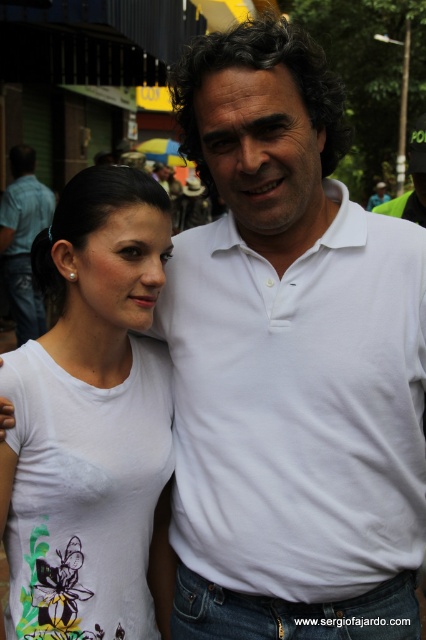
Question: Does white matte t-shirt at center appear under matte white shirt at center?

Choices:
 (A) no
 (B) yes

Answer: (B)

Question: Is white cotton shirt at center further to camera compared to white matte t-shirt at center?

Choices:
 (A) no
 (B) yes

Answer: (A)

Question: Which of these objects is positioned closest to the white matte t-shirt at center?

Choices:
 (A) white cotton shirt at center
 (B) matte white shirt at center

Answer: (A)

Question: Based on their relative distances, which object is nearer to the matte white shirt at center?

Choices:
 (A) white cotton shirt at center
 (B) white matte t-shirt at center

Answer: (B)

Question: Is white cotton shirt at center to the left of matte white shirt at center from the viewer's perspective?

Choices:
 (A) no
 (B) yes

Answer: (A)

Question: Among these points, which one is farthest from the camera?

Choices:
 (A) (28, 292)
 (B) (74, 372)
 (C) (296, 358)

Answer: (A)